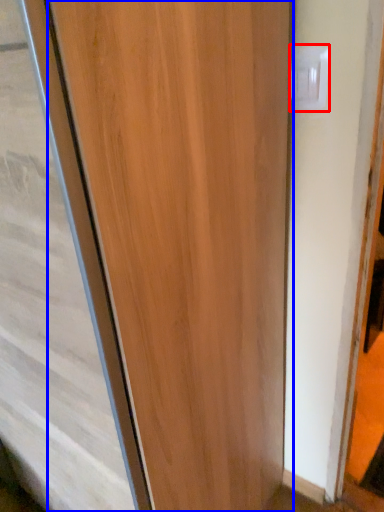
Question: Which object is closer to the camera taking this photo, electric outlet (highlighted by a red box) or door (highlighted by a blue box)?

Choices:
 (A) electric outlet
 (B) door

Answer: (B)